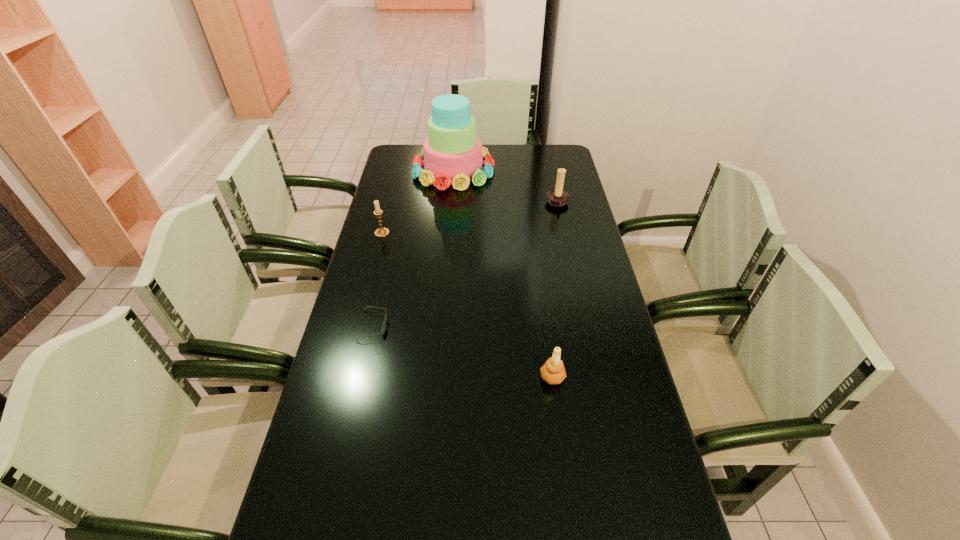
What are the coordinates of `free space that is in between the second nearest candle_holder and the second candle_holder from right to left` in the screenshot? It's located at (468, 305).

The width and height of the screenshot is (960, 540). I want to click on empty space that is in between the second farthest object and the cake, so click(506, 187).

Find the location of a particular element. This screenshot has height=540, width=960. empty space that is in between the nearest object and the shortest object is located at coordinates (463, 352).

Where is `blank region between the second object from right to left and the leftmost candle_holder`? The height and width of the screenshot is (540, 960). blank region between the second object from right to left and the leftmost candle_holder is located at coordinates (468, 305).

At what (x,y) coordinates should I click in order to perform the action: click on vacant space that is in between the nearest object and the farthest object. Please return your answer as a coordinate pair (x, y). The width and height of the screenshot is (960, 540). Looking at the image, I should click on (503, 273).

You are a GUI agent. You are given a task and a screenshot of the screen. Output one action in this format:
    pyautogui.click(x=<x>, y=<y>)
    Task: Click on the object that is the closest to the farthest object
    The height and width of the screenshot is (540, 960).
    Given the screenshot: What is the action you would take?
    (x=557, y=197)

At what (x,y) coordinates should I click in order to perform the action: click on object that ranks as the closest to the rightmost object. Please return your answer as a coordinate pair (x, y). Looking at the image, I should click on (452, 153).

Locate which candle_holder is the closest to the sunglasses. Please provide its 2D coordinates. Your answer should be formatted as a tuple, i.e. [(x, y)], where the tuple contains the x and y coordinates of a point satisfying the conditions above.

[(381, 232)]

You are a GUI agent. You are given a task and a screenshot of the screen. Output one action in this format:
    pyautogui.click(x=<x>, y=<y>)
    Task: Click on the candle_holder that stands as the closest to the cake
    
    Given the screenshot: What is the action you would take?
    pyautogui.click(x=557, y=197)

Locate an element on the screen. vacant space that satisfies the following two spatial constraints: 1. on the back side of the nearest candle_holder; 2. on the lenses of the sunglasses is located at coordinates (545, 326).